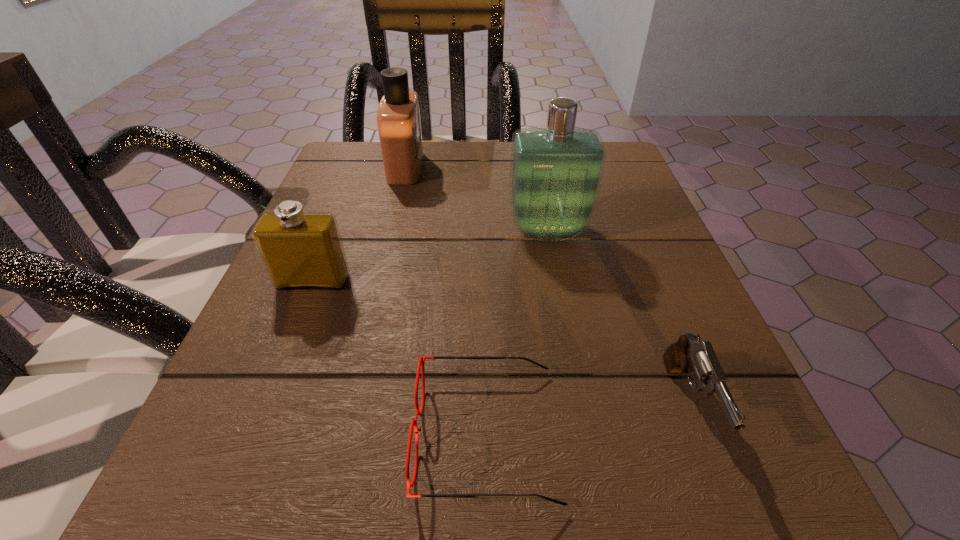
Identify the location of the second farthest object. The height and width of the screenshot is (540, 960). (555, 176).

Identify the location of the rightmost perfume. (555, 176).

Identify the location of the second perfume from right to left. The image size is (960, 540). (398, 115).

Identify the location of the farthest perfume. The height and width of the screenshot is (540, 960). (398, 115).

Where is `the leftmost perfume`? The height and width of the screenshot is (540, 960). the leftmost perfume is located at coordinates (300, 250).

At what (x,y) coordinates should I click in order to perform the action: click on the shortest perfume. Please return your answer as a coordinate pair (x, y). Looking at the image, I should click on (300, 250).

Locate an element on the screen. The width and height of the screenshot is (960, 540). pistol is located at coordinates (689, 354).

Locate an element on the screen. The height and width of the screenshot is (540, 960). the rightmost object is located at coordinates (689, 354).

What are the coordinates of `the shortest object` in the screenshot? It's located at (421, 361).

This screenshot has height=540, width=960. What are the coordinates of `vacant space located on the front label of the rightmost perfume` in the screenshot? It's located at (564, 318).